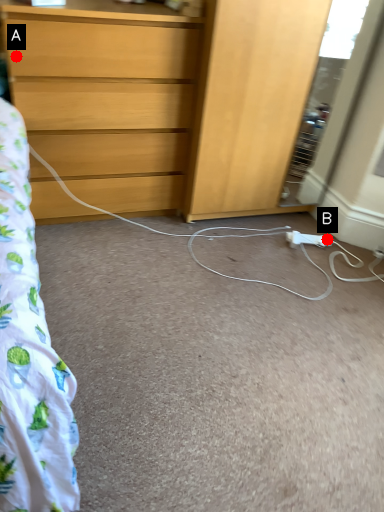
Question: Two points are circled on the image, labeled by A and B beside each circle. Which point appears closest to the camera in this image?

Choices:
 (A) A is closer
 (B) B is closer

Answer: (A)